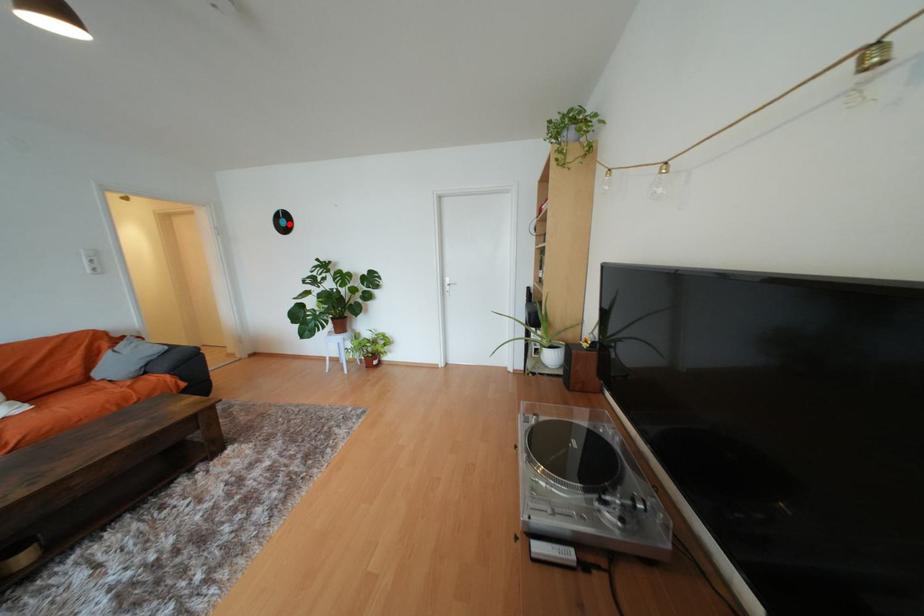
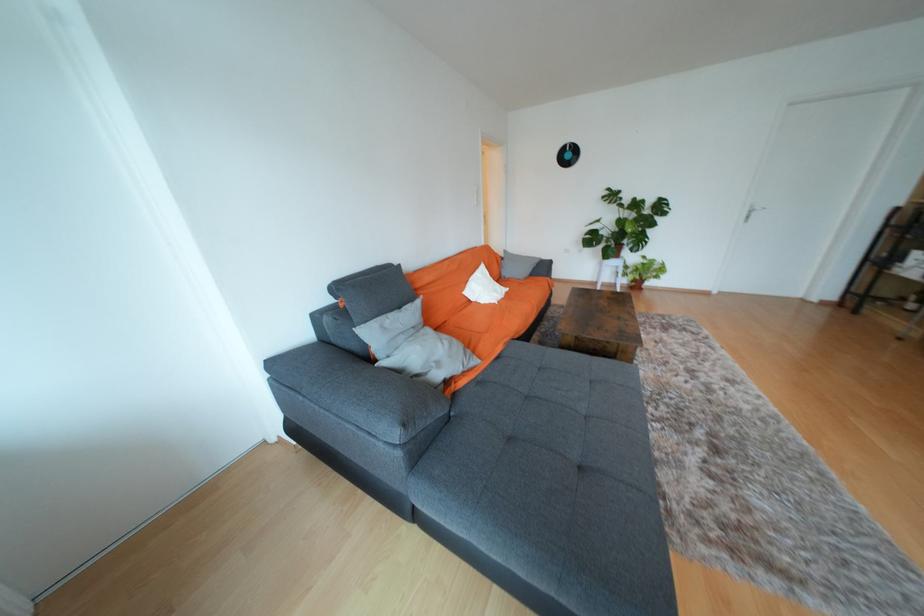
The point at the highlighted location is marked in the first image. Where is the corresponding point in the second image?

(574, 156)